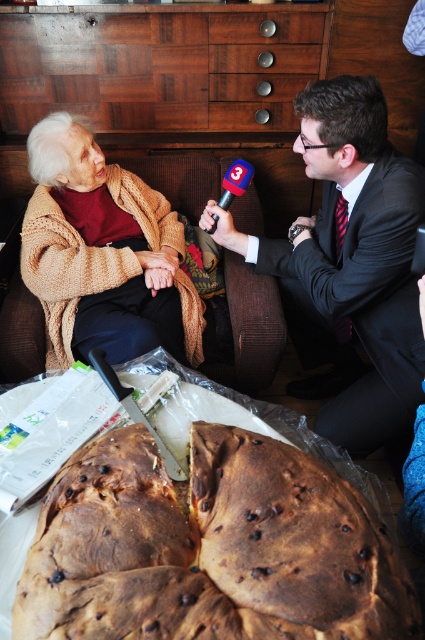
Looking at this image, is dark suit at center to the right of knitted beige sweater at upper left from the viewer's perspective?

Indeed, dark suit at center is positioned on the right side of knitted beige sweater at upper left.

Is dark suit at center shorter than knitted beige sweater at upper left?

No.

Where is `dark suit at center`? The width and height of the screenshot is (425, 640). dark suit at center is located at coordinates (351, 268).

Locate an element on the screen. This screenshot has height=640, width=425. dark suit at center is located at coordinates (351, 268).

Looking at this image, is brown crumbly bread at center positioned at the back of knitted beige sweater at upper left?

No, it is not.

Is brown crumbly bread at center below knitted beige sweater at upper left?

Yes.

You are a GUI agent. You are given a task and a screenshot of the screen. Output one action in this format:
    pyautogui.click(x=<x>, y=<y>)
    Task: Click on the brown crumbly bread at center
    This screenshot has height=640, width=425.
    Given the screenshot: What is the action you would take?
    pyautogui.click(x=209, y=548)

Find the location of `brown crumbly bread at center`. brown crumbly bread at center is located at coordinates (209, 548).

What are the coordinates of `brown crumbly bread at center` in the screenshot? It's located at (209, 548).

The width and height of the screenshot is (425, 640). Find the location of `brown crumbly bread at center`. brown crumbly bread at center is located at coordinates (209, 548).